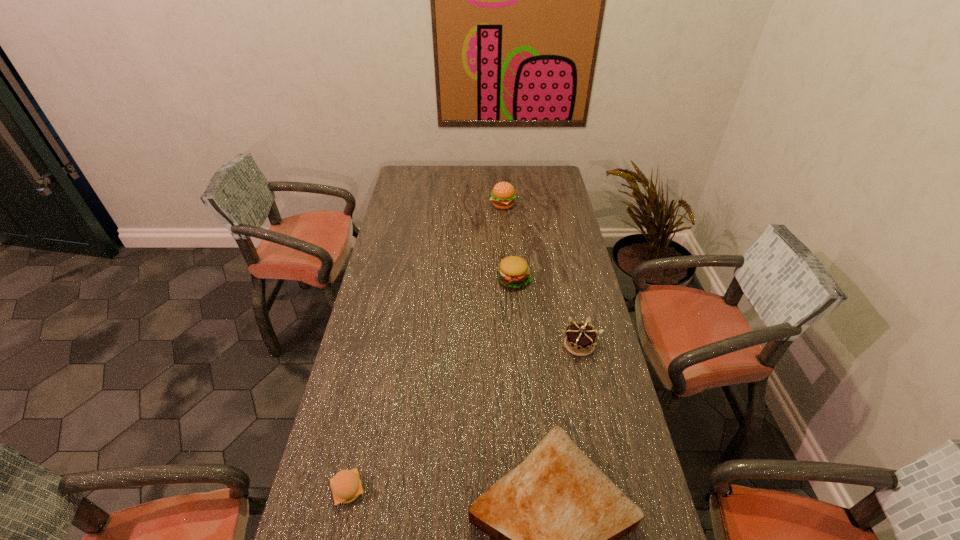
Locate an element on the screen. The width and height of the screenshot is (960, 540). the tallest object is located at coordinates (503, 194).

The height and width of the screenshot is (540, 960). I want to click on the farthest object, so click(503, 194).

Identify the location of crown. This screenshot has width=960, height=540. (580, 339).

The width and height of the screenshot is (960, 540). What are the coordinates of `the fourth nearest object` in the screenshot? It's located at (513, 272).

You are a GUI agent. You are given a task and a screenshot of the screen. Output one action in this format:
    pyautogui.click(x=<x>, y=<y>)
    Task: Click on the second tallest hamburger
    
    Given the screenshot: What is the action you would take?
    click(513, 272)

The image size is (960, 540). I want to click on the shortest hamburger, so click(346, 486).

The image size is (960, 540). I want to click on the leftmost object, so click(x=346, y=486).

The height and width of the screenshot is (540, 960). I want to click on vacant space located on the front of the farthest object, so click(504, 230).

This screenshot has height=540, width=960. What are the coordinates of `vacant space located 0.200m on the left of the crown` in the screenshot? It's located at (498, 345).

Where is `blank area located on the left of the fourth nearest object`? blank area located on the left of the fourth nearest object is located at coordinates (417, 280).